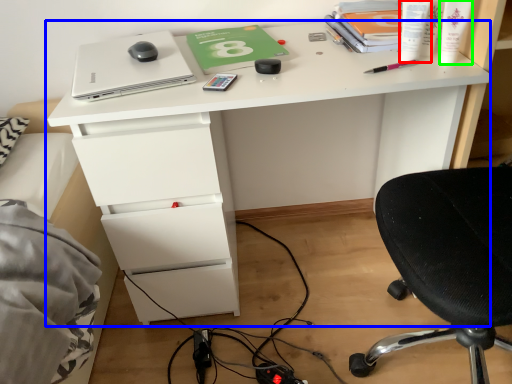
Question: Which object is the farthest from stationery (highlighted by a red box)? Choose among these: desk (highlighted by a blue box) or toiletry (highlighted by a green box).

Choices:
 (A) desk
 (B) toiletry

Answer: (A)